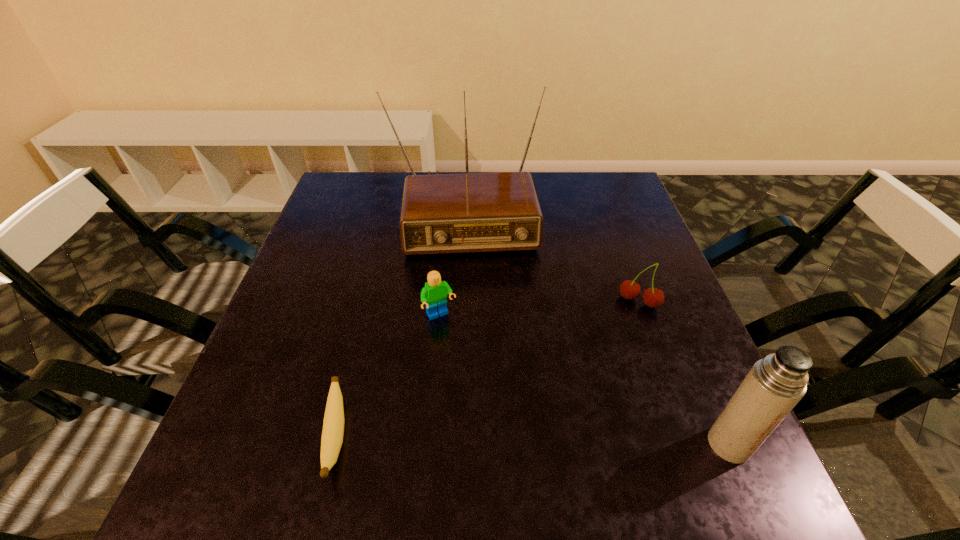
The height and width of the screenshot is (540, 960). Identify the location of object that stands as the closest to the cherry. (474, 212).

The width and height of the screenshot is (960, 540). I want to click on free space that satisfies the following two spatial constraints: 1. on the back side of the cherry; 2. on the right side of the Lego, so click(x=442, y=301).

I want to click on vacant space that satisfies the following two spatial constraints: 1. on the back side of the banana; 2. on the left side of the cherry, so click(370, 301).

The height and width of the screenshot is (540, 960). I want to click on vacant space that satisfies the following two spatial constraints: 1. on the front side of the fourth shortest object; 2. on the right side of the farthest object, so click(454, 444).

At what (x,y) coordinates should I click in order to perform the action: click on free spot that satisfies the following two spatial constraints: 1. on the front side of the Lego; 2. on the left side of the thermos bottle. Please return your answer as a coordinate pair (x, y). Looking at the image, I should click on (429, 444).

Where is `free space that satisfies the following two spatial constraints: 1. on the back side of the cherry; 2. on the right side of the shortest object`? free space that satisfies the following two spatial constraints: 1. on the back side of the cherry; 2. on the right side of the shortest object is located at coordinates (370, 301).